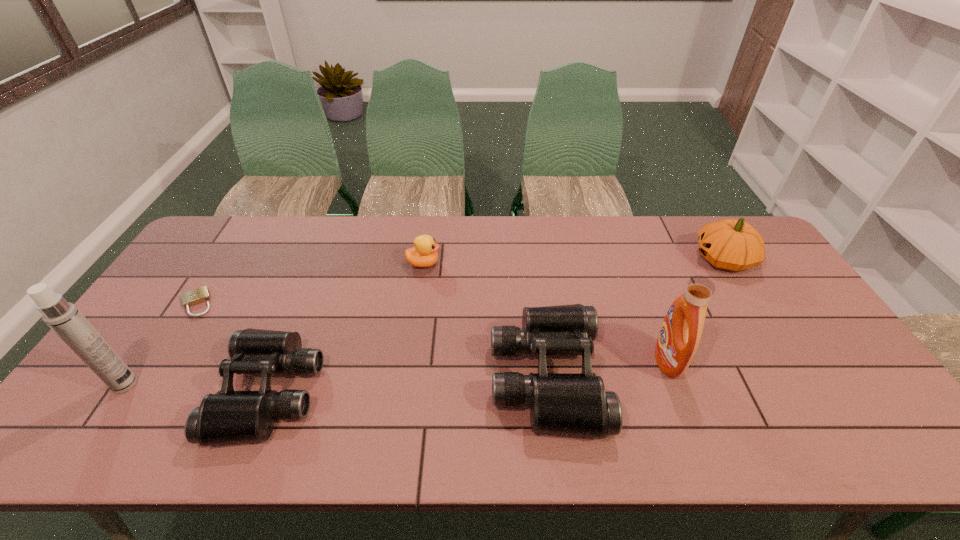
This screenshot has width=960, height=540. Identify the location of the tallest object. (63, 317).

Find the location of a particular element. vacant space located 0.260m on the front-facing side of the left binoculars is located at coordinates (117, 392).

Locate an element on the screen. This screenshot has height=540, width=960. free space located 0.050m on the front-facing side of the left binoculars is located at coordinates (203, 392).

The image size is (960, 540). I want to click on vacant region located 0.270m on the front-facing side of the left binoculars, so click(x=113, y=392).

The height and width of the screenshot is (540, 960). Find the location of `free space located 0.190m on the front-facing side of the fifth object from left to right`. free space located 0.190m on the front-facing side of the fifth object from left to right is located at coordinates [x=676, y=376].

What are the coordinates of `vacant space located 0.350m on the face of the duckling` in the screenshot? It's located at (548, 264).

This screenshot has height=540, width=960. I want to click on vacant space situated on the back of the padlock, so click(237, 240).

Identify the location of free space located 0.290m on the side of the rightmost object with the carved face. (605, 259).

Find the location of a particular element. free space located 0.400m on the side of the rightmost object with the carved face is located at coordinates (571, 259).

Find the location of a particular element. The width and height of the screenshot is (960, 540). vacant space located on the side of the rightmost object with the carved face is located at coordinates (605, 259).